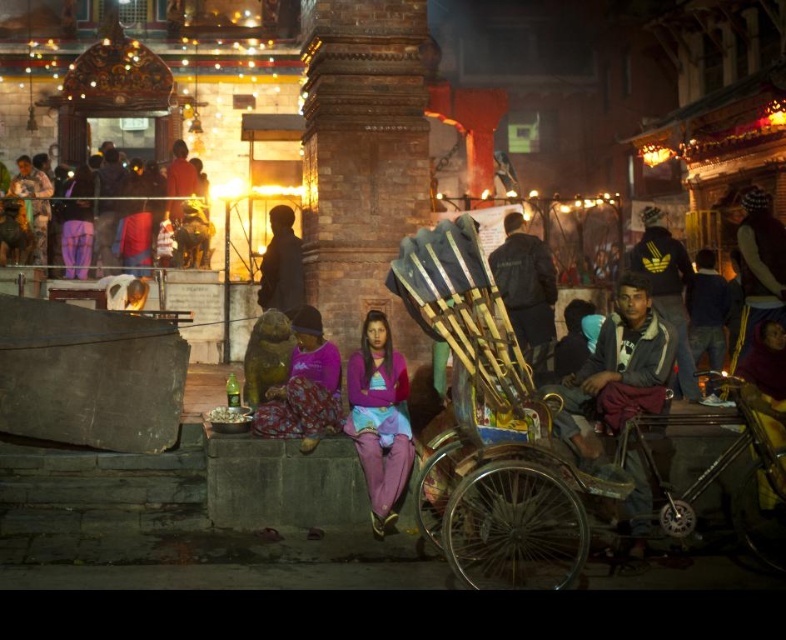
Question: Does purple fleece jacket at center have a greater width compared to black leather jacket at center?

Choices:
 (A) no
 (B) yes

Answer: (B)

Question: Which of the following is the farthest from the observer?

Choices:
 (A) (270, 419)
 (B) (289, 209)
 (C) (581, 312)

Answer: (C)

Question: Which point is farther from the camera taking this photo?

Choices:
 (A) (707, 332)
 (B) (637, 326)
 (C) (173, 234)
 (D) (351, 401)

Answer: (C)

Question: Which point is farther to the camera?

Choices:
 (A) (277, 259)
 (B) (689, 378)
 (C) (406, 413)

Answer: (A)

Question: Does gray fabric jacket at right have a smaller size compared to purple fleece jacket at center?

Choices:
 (A) yes
 (B) no

Answer: (B)

Question: Observing the image, what is the correct spatial positioning of purple fleece jacket at center in reference to black leather jacket at center?

Choices:
 (A) right
 (B) left

Answer: (B)